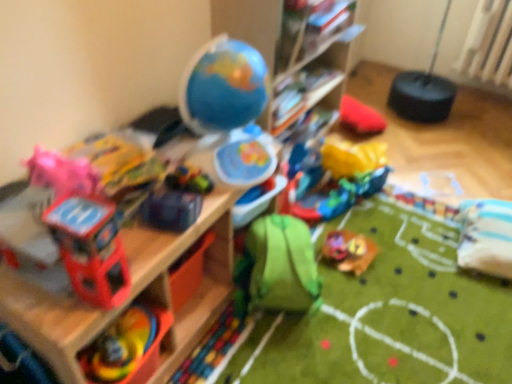
At what (x,y) coordinates should I click in order to perform the action: click on wooden shelf at upper left, placed as the 2th shelf when sorted from right to left. Please return your answer as a coordinate pair (x, y). The height and width of the screenshot is (384, 512). Looking at the image, I should click on (166, 276).

The image size is (512, 384). Find the location of `white plastic radiator at upper right`. white plastic radiator at upper right is located at coordinates (489, 46).

Image resolution: width=512 pixels, height=384 pixels. In order to click on matte plastic toy helicopter at left, which is the second toy from left to right in this screenshot , I will do `click(83, 228)`.

How much space does multicolored plastic toy at lower left, positioned as the second toy in front-to-back order, occupy vertically?

multicolored plastic toy at lower left, positioned as the second toy in front-to-back order, is 5.18 centimeters tall.

This screenshot has height=384, width=512. I want to click on shiny blue car at center, the third toy positioned from the right, so click(x=177, y=199).

What do you see at coordinates (177, 199) in the screenshot? The image size is (512, 384). I see `shiny blue car at center, which is counted as the 3th toy, starting from the back` at bounding box center [177, 199].

Locate an element on the screen. This screenshot has width=512, height=384. wooden shelf at upper left, placed as the 2th shelf when sorted from right to left is located at coordinates (166, 276).

From their relative heights in the image, would you say shiny blue car at center, arranged as the third toy when viewed from the front, is taller or shorter than shiny plastic toy car at center, marked as the 5th toy in a front-to-back arrangement?

shiny blue car at center, arranged as the third toy when viewed from the front, is taller than shiny plastic toy car at center, marked as the 5th toy in a front-to-back arrangement.

Consider the image. Does shiny blue car at center, placed as the third toy when sorted from left to right, have a greater width compared to shiny plastic toy car at center, which is the 5th toy from left to right?

In fact, shiny blue car at center, placed as the third toy when sorted from left to right, might be narrower than shiny plastic toy car at center, which is the 5th toy from left to right.

Can you tell me how much shiny blue car at center, placed as the third toy when sorted from left to right, and shiny plastic toy car at center, marked as the 5th toy in a front-to-back arrangement, differ in facing direction?

21.5 degrees.

Between shiny blue car at center, which is counted as the 3th toy, starting from the back, and shiny plastic toy car at center, which is the 1th toy in back-to-front order, which one has smaller size?

shiny blue car at center, which is counted as the 3th toy, starting from the back.

Between wooden shelf at upper center, acting as the first shelf starting from the top, and wooden shelf at upper left, which ranks as the 2th shelf in top-to-bottom order, which one has more height?

wooden shelf at upper left, which ranks as the 2th shelf in top-to-bottom order, is taller.

From a real-world perspective, does wooden shelf at upper center, acting as the first shelf starting from the top, sit lower than wooden shelf at upper left, which is counted as the first shelf, starting from the left?

Incorrect, from a real-world perspective, wooden shelf at upper center, acting as the first shelf starting from the top, is higher than wooden shelf at upper left, which is counted as the first shelf, starting from the left.

At what (x,y) coordinates should I click in order to perform the action: click on shelf on the left of wooden shelf at upper center, which is counted as the 1th shelf, starting from the right. Please return your answer as a coordinate pair (x, y). Looking at the image, I should click on (166, 276).

Where is `radiator above the matte plastic toy helicopter at left, which appears as the fourth toy when viewed from the right (from the image's perspective)`? radiator above the matte plastic toy helicopter at left, which appears as the fourth toy when viewed from the right (from the image's perspective) is located at coordinates (489, 46).

Are matte plastic toy helicopter at left, which appears as the fourth toy when viewed from the right, and white plastic radiator at upper right beside each other?

No, matte plastic toy helicopter at left, which appears as the fourth toy when viewed from the right, is not next to white plastic radiator at upper right.

Which is behind, matte plastic toy helicopter at left, which ranks as the fifth toy in back-to-front order, or white plastic radiator at upper right?

white plastic radiator at upper right is further from the camera.

Considering the relative sizes of matte plastic toy helicopter at left, which appears as the fourth toy when viewed from the right, and white plastic radiator at upper right in the image provided, is matte plastic toy helicopter at left, which appears as the fourth toy when viewed from the right, wider than white plastic radiator at upper right?

In fact, matte plastic toy helicopter at left, which appears as the fourth toy when viewed from the right, might be narrower than white plastic radiator at upper right.

Does white plastic radiator at upper right have a lesser height compared to shiny plastic toy car at center, acting as the 1th toy starting from the right?

In fact, white plastic radiator at upper right may be taller than shiny plastic toy car at center, acting as the 1th toy starting from the right.

Is white plastic radiator at upper right thinner than shiny plastic toy car at center, which is the 5th toy from left to right?

Indeed, white plastic radiator at upper right has a lesser width compared to shiny plastic toy car at center, which is the 5th toy from left to right.

From a real-world perspective, is white plastic radiator at upper right physically above shiny plastic toy car at center, acting as the 1th toy starting from the right?

Correct, in the physical world, white plastic radiator at upper right is higher than shiny plastic toy car at center, acting as the 1th toy starting from the right.

In the scene shown: From the image's perspective, is white plastic radiator at upper right on shiny plastic toy car at center, which is the 1th toy in back-to-front order?

Indeed, from the image's perspective, white plastic radiator at upper right is shown above shiny plastic toy car at center, which is the 1th toy in back-to-front order.

Which is behind, point (180, 191) or point (284, 265)?

The point (284, 265) is behind.

From a real-world perspective, is shiny blue car at center, placed as the third toy when sorted from left to right, under green fabric backpack at center, which appears as the 2th toy when viewed from the right?

Incorrect, from a real-world perspective, shiny blue car at center, placed as the third toy when sorted from left to right, is higher than green fabric backpack at center, which appears as the 2th toy when viewed from the right.

Is white plastic radiator at upper right at the back of green fabric backpack at center, the fourth toy when ordered from front to back?

No, green fabric backpack at center, the fourth toy when ordered from front to back, is not facing the opposite direction of white plastic radiator at upper right.

Would you say green fabric backpack at center, acting as the fourth toy starting from the left, contains white plastic radiator at upper right?

No, white plastic radiator at upper right is located outside of green fabric backpack at center, acting as the fourth toy starting from the left.

Which is closer, (304,295) or (492,23)?

Clearly, point (304,295) is closer to the camera than point (492,23).

Which of these two, green fabric backpack at center, placed as the 2th toy when sorted from back to front, or white plastic radiator at upper right, is thinner?

Thinner between the two is white plastic radiator at upper right.

Is multicolored plastic toy at lower left, the fourth toy from the back, inside wooden shelf at upper left, which ranks as the 2th shelf in top-to-bottom order?

Yes, multicolored plastic toy at lower left, the fourth toy from the back, is a part of wooden shelf at upper left, which ranks as the 2th shelf in top-to-bottom order.

There is a wooden shelf at upper left, which is counted as the first shelf, starting from the left. What are the coordinates of `the 1st toy above it (from a real-world perspective)` in the screenshot? It's located at (128, 348).

From a real-world perspective, is wooden shelf at upper left, which is counted as the 1th shelf, starting from the bottom, below multicolored plastic toy at lower left, the fourth toy from the back?

Correct, in the physical world, wooden shelf at upper left, which is counted as the 1th shelf, starting from the bottom, is lower than multicolored plastic toy at lower left, the fourth toy from the back.

Is wooden shelf at upper left, placed as the 2th shelf when sorted from right to left, shorter than multicolored plastic toy at lower left, the fourth toy from the back?

In fact, wooden shelf at upper left, placed as the 2th shelf when sorted from right to left, may be taller than multicolored plastic toy at lower left, the fourth toy from the back.

From the shiny blue car at center, placed as the third toy when sorted from left to right, count 2nd toy to the right and point to it. Please provide its 2D coordinates.

[(349, 250)]

This screenshot has width=512, height=384. I want to click on shelf that appears in front of the wooden shelf at upper center, which is counted as the 1th shelf, starting from the right, so click(x=166, y=276).

Based on their spatial positions, is green fabric backpack at center, placed as the 2th toy when sorted from back to front, or white plastic radiator at upper right closer to multicolored plastic toy at lower left, the fourth toy from the back?

green fabric backpack at center, placed as the 2th toy when sorted from back to front, is closer to multicolored plastic toy at lower left, the fourth toy from the back.

Based on their spatial positions, is multicolored plastic toy at lower left, acting as the 5th toy starting from the right, or wooden shelf at upper left, which is counted as the first shelf, starting from the left, further from wooden shelf at upper center, positioned as the second shelf in bottom-to-top order?

multicolored plastic toy at lower left, acting as the 5th toy starting from the right, is positioned further to the anchor wooden shelf at upper center, positioned as the second shelf in bottom-to-top order.

Which object lies further to the anchor point matte plastic toy helicopter at left, which ranks as the fifth toy in back-to-front order, shiny plastic toy car at center, which is the 1th toy in back-to-front order, or multicolored plastic toy at lower left, positioned as the second toy in front-to-back order?

shiny plastic toy car at center, which is the 1th toy in back-to-front order, lies further to matte plastic toy helicopter at left, which ranks as the fifth toy in back-to-front order, than the other object.

Estimate the real-world distances between objects in this image. Which object is further from shiny blue car at center, the third toy positioned from the right, shiny plastic toy car at center, acting as the 1th toy starting from the right, or matte plastic toy helicopter at left, which appears as the fourth toy when viewed from the right?

Among the two, shiny plastic toy car at center, acting as the 1th toy starting from the right, is located further to shiny blue car at center, the third toy positioned from the right.

Considering their positions, is matte plastic toy helicopter at left, which appears as the fourth toy when viewed from the right, positioned closer to shiny plastic toy car at center, which is the 5th toy from left to right, than wooden shelf at upper center, positioned as the second shelf in bottom-to-top order?

wooden shelf at upper center, positioned as the second shelf in bottom-to-top order, is positioned closer to the anchor shiny plastic toy car at center, which is the 5th toy from left to right.

Estimate the real-world distances between objects in this image. Which object is further from wooden shelf at upper left, which is counted as the first shelf, starting from the left, green fabric backpack at center, acting as the fourth toy starting from the left, or multicolored plastic toy at lower left, the fourth toy from the back?

The object further to wooden shelf at upper left, which is counted as the first shelf, starting from the left, is green fabric backpack at center, acting as the fourth toy starting from the left.

Looking at the image, which one is located closer to multicolored plastic toy at lower left, positioned as the second toy in front-to-back order, shiny plastic toy car at center, marked as the 5th toy in a front-to-back arrangement, or matte plastic toy helicopter at left, which appears as the fourth toy when viewed from the right?

matte plastic toy helicopter at left, which appears as the fourth toy when viewed from the right.

Considering their positions, is shiny blue car at center, arranged as the third toy when viewed from the front, positioned closer to multicolored plastic toy at lower left, acting as the 1th toy starting from the left, than wooden shelf at upper center, which is counted as the 1th shelf, starting from the right?

The object closer to multicolored plastic toy at lower left, acting as the 1th toy starting from the left, is shiny blue car at center, arranged as the third toy when viewed from the front.

Identify the location of shelf between matte plastic toy helicopter at left, which ranks as the fifth toy in back-to-front order, and shiny blue car at center, which is counted as the 3th toy, starting from the back, from front to back. This screenshot has height=384, width=512. (166, 276).

Find the location of a particular element. shelf situated between green fabric backpack at center, which appears as the 2th toy when viewed from the right, and white plastic radiator at upper right from left to right is located at coordinates (310, 29).

This screenshot has height=384, width=512. What are the coordinates of `shelf between matte plastic toy helicopter at left, which is the second toy from left to right, and multicolored plastic toy at lower left, acting as the 1th toy starting from the left, in the vertical direction` in the screenshot? It's located at (166, 276).

The image size is (512, 384). What are the coordinates of `shelf between shiny blue car at center, which is counted as the 3th toy, starting from the back, and multicolored plastic toy at lower left, acting as the 1th toy starting from the left, in the vertical direction` in the screenshot? It's located at [x=166, y=276].